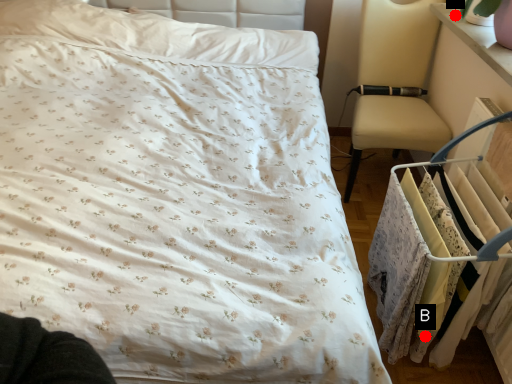
Question: Two points are circled on the image, labeled by A and B beside each circle. Which point is closer to the camera?

Choices:
 (A) A is closer
 (B) B is closer

Answer: (B)